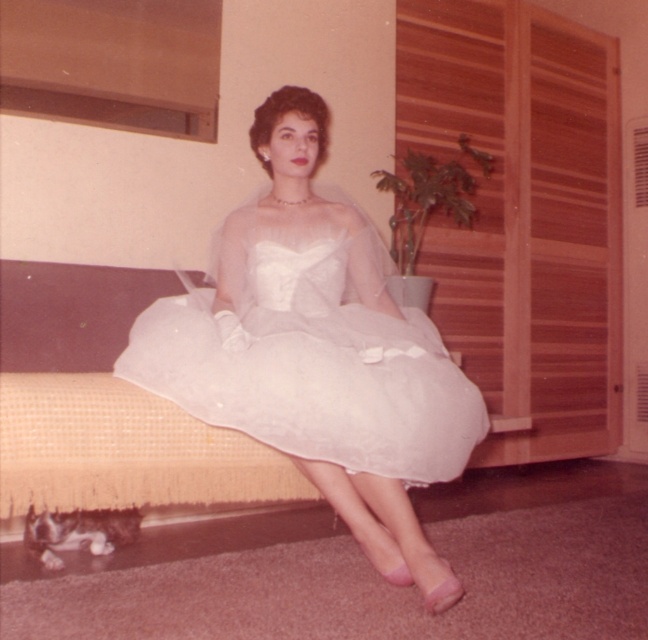
Question: Is the position of white satin dress at center more distant than that of white sheer dress at center?

Choices:
 (A) no
 (B) yes

Answer: (A)

Question: Does white satin dress at center lie in front of white sheer dress at center?

Choices:
 (A) yes
 (B) no

Answer: (A)

Question: Among these points, which one is nearest to the camera?

Choices:
 (A) (373, 266)
 (B) (437, 353)

Answer: (B)

Question: Which point is farther from the camera taking this photo?

Choices:
 (A) (402, 445)
 (B) (384, 372)

Answer: (B)

Question: Is white satin dress at center to the right of white sheer dress at center from the viewer's perspective?

Choices:
 (A) yes
 (B) no

Answer: (B)